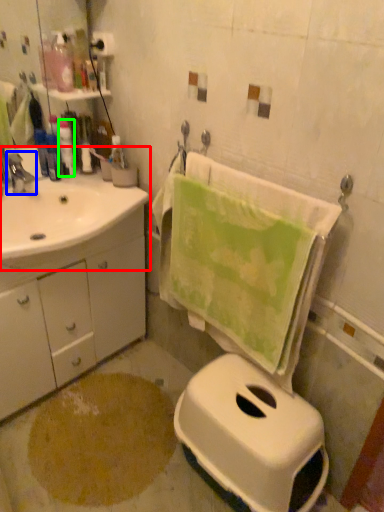
Question: Considering the real-world distances, which object is closest to sink (highlighted by a red box)? tap (highlighted by a blue box) or toiletry (highlighted by a green box).

Choices:
 (A) tap
 (B) toiletry

Answer: (A)